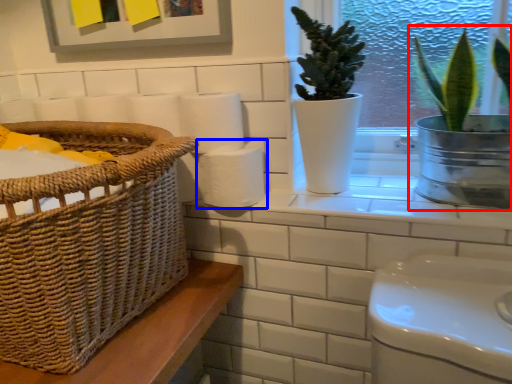
Question: Which object is closer to the camera taking this photo, houseplant (highlighted by a red box) or toilet paper (highlighted by a blue box)?

Choices:
 (A) houseplant
 (B) toilet paper

Answer: (A)